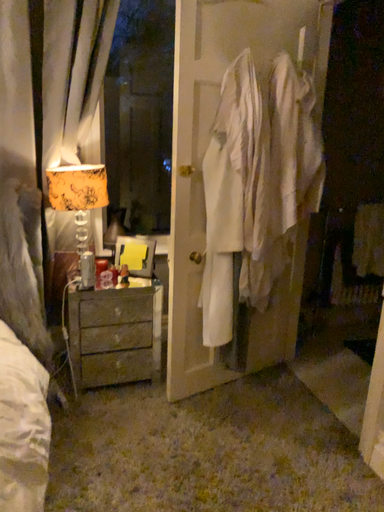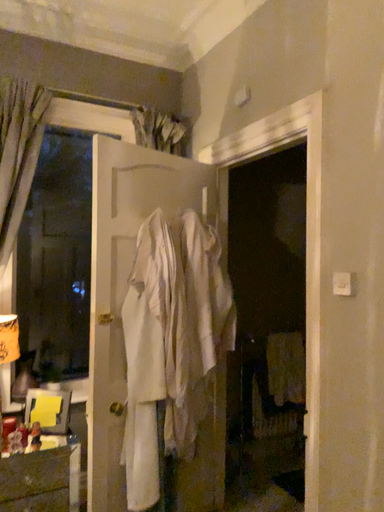
Question: Which way did the camera rotate in the video?

Choices:
 (A) rotated right
 (B) rotated left

Answer: (A)